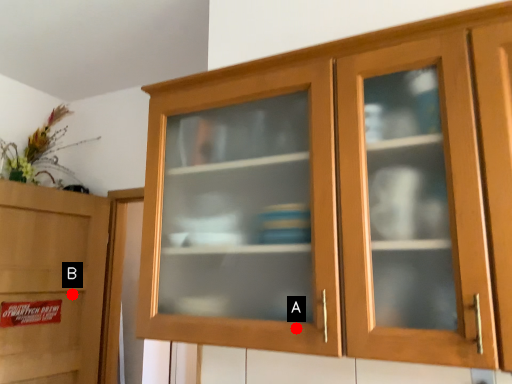
Question: Two points are circled on the image, labeled by A and B beside each circle. Which point is further to the camera?

Choices:
 (A) A is further
 (B) B is further

Answer: (B)